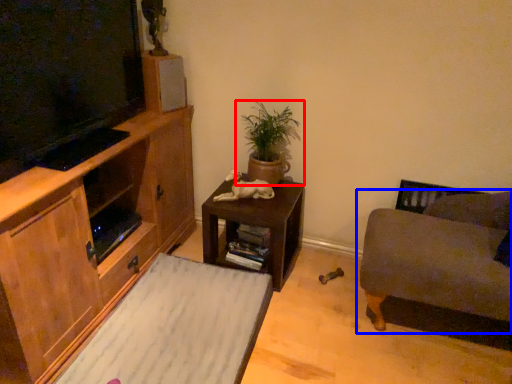
Question: Among these objects, which one is farthest to the camera, houseplant (highlighted by a red box) or studio couch (highlighted by a blue box)?

Choices:
 (A) houseplant
 (B) studio couch

Answer: (A)